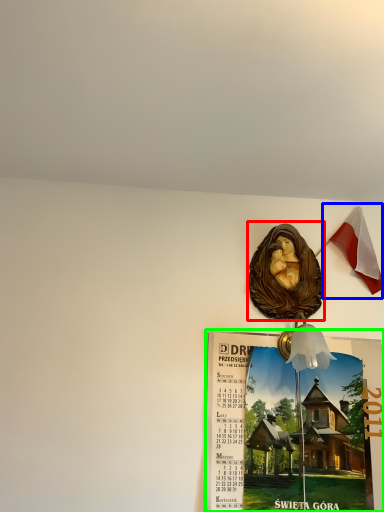
Question: Based on their relative distances, which object is farther from art (highlighted by a red box)? Choose from national flag (highlighted by a blue box) and poster page (highlighted by a green box).

Choices:
 (A) national flag
 (B) poster page

Answer: (B)